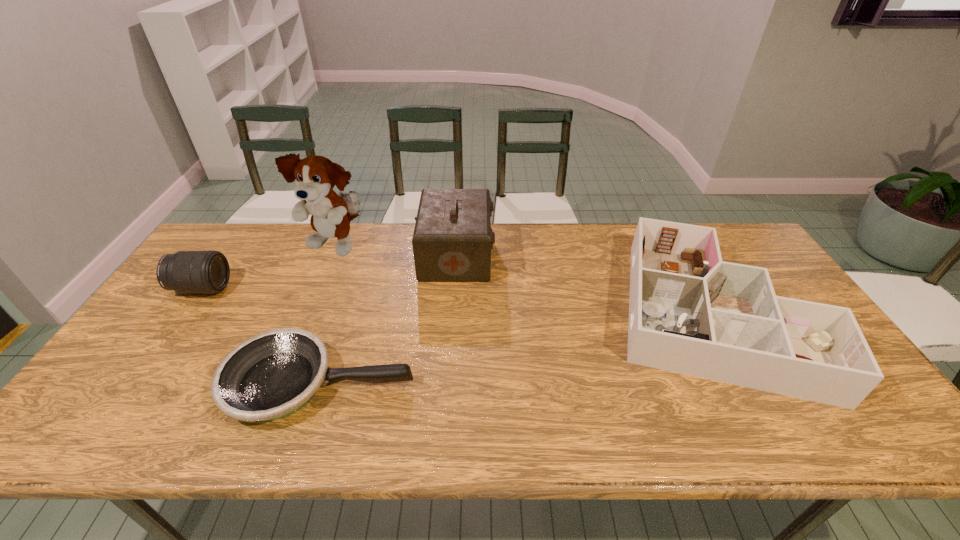
Locate an element on the screen. The height and width of the screenshot is (540, 960). free region at the near edge of the desktop is located at coordinates (276, 445).

Locate an element on the screen. blank space at the left edge of the desktop is located at coordinates (144, 365).

I want to click on vacant area that lies between the frying pan and the puppy, so click(327, 315).

Image resolution: width=960 pixels, height=540 pixels. Find the location of `free space between the tallest object and the leftmost object`. free space between the tallest object and the leftmost object is located at coordinates (269, 268).

Find the location of a particular element. Image resolution: width=960 pixels, height=540 pixels. vacant space in between the tallest object and the shortest object is located at coordinates (327, 315).

Locate an element on the screen. The width and height of the screenshot is (960, 540). free space that is in between the dollhouse and the shortest object is located at coordinates (515, 349).

In order to click on vacant space in between the dollhouse and the leftmost object in this screenshot , I will do `click(455, 301)`.

Image resolution: width=960 pixels, height=540 pixels. In order to click on free space between the telephoto lens and the rightmost object in this screenshot , I will do `click(455, 301)`.

Locate an element on the screen. This screenshot has width=960, height=540. free spot between the leftmost object and the rightmost object is located at coordinates (455, 301).

This screenshot has width=960, height=540. I want to click on blank region between the shortest object and the rightmost object, so click(x=515, y=349).